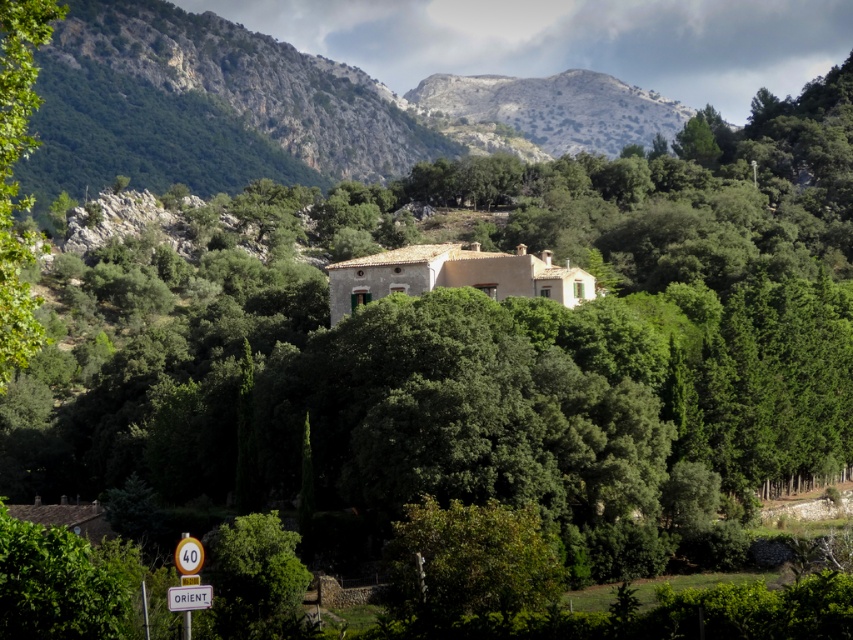
The height and width of the screenshot is (640, 853). I want to click on rugged stone hillside at upper center, so click(555, 108).

Does point (602, 80) come farther from viewer compared to point (184, 605)?

Yes, point (602, 80) is behind point (184, 605).

Locate an element on the screen. rugged stone hillside at upper center is located at coordinates (555, 108).

Can you confirm if green leafy tree at left is positioned to the right of green leafy tree at lower left?

In fact, green leafy tree at left is to the left of green leafy tree at lower left.

Find the location of a particular element. The height and width of the screenshot is (640, 853). green leafy tree at left is located at coordinates (10, 172).

Is point (514, 580) positioned in front of point (587, 113)?

Yes, point (514, 580) is in front of point (587, 113).

Is green leafy tree at lower center shorter than rugged stone hillside at upper center?

Indeed, green leafy tree at lower center has a lesser height compared to rugged stone hillside at upper center.

The image size is (853, 640). What do you see at coordinates (469, 563) in the screenshot?
I see `green leafy tree at lower center` at bounding box center [469, 563].

In order to click on green leafy tree at lower center in this screenshot , I will do `click(469, 563)`.